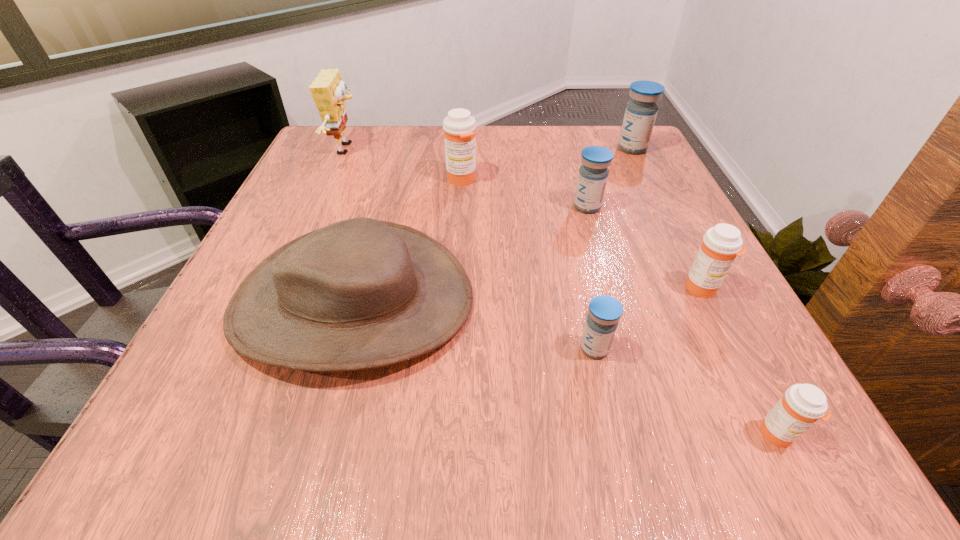
You are a GUI agent. You are given a task and a screenshot of the screen. Output one action in this format:
    pyautogui.click(x=<x>, y=<y>)
    Task: Click on the vacant space located on the back of the smallest blue medicine
    The height and width of the screenshot is (540, 960).
    Given the screenshot: What is the action you would take?
    pyautogui.click(x=565, y=224)

Locate an element on the screen. free spot located 0.080m on the back of the nearest object is located at coordinates 743,366.

Identify the location of sponge that is positioned at the far edge. (327, 90).

The width and height of the screenshot is (960, 540). In order to click on object positioned at the near edge in this screenshot , I will do `click(802, 405)`.

You are a GUI agent. You are given a task and a screenshot of the screen. Output one action in this format:
    pyautogui.click(x=<x>, y=<y>)
    Task: Click on the sponge that is at the left edge
    This screenshot has height=540, width=960.
    Given the screenshot: What is the action you would take?
    pyautogui.click(x=327, y=90)

Where is `cowboy hat that is at the left edge`? The image size is (960, 540). cowboy hat that is at the left edge is located at coordinates tap(360, 293).

The width and height of the screenshot is (960, 540). Identify the location of object that is at the far left corner. (327, 90).

The image size is (960, 540). I want to click on object present at the far right corner, so click(x=640, y=114).

At what (x,y) coordinates should I click in order to perform the action: click on object that is positioned at the near right corner. Please return your answer as a coordinate pair (x, y). This screenshot has height=540, width=960. Looking at the image, I should click on (802, 405).

The height and width of the screenshot is (540, 960). In order to click on free region at the far edge of the desktop in this screenshot , I will do `click(419, 158)`.